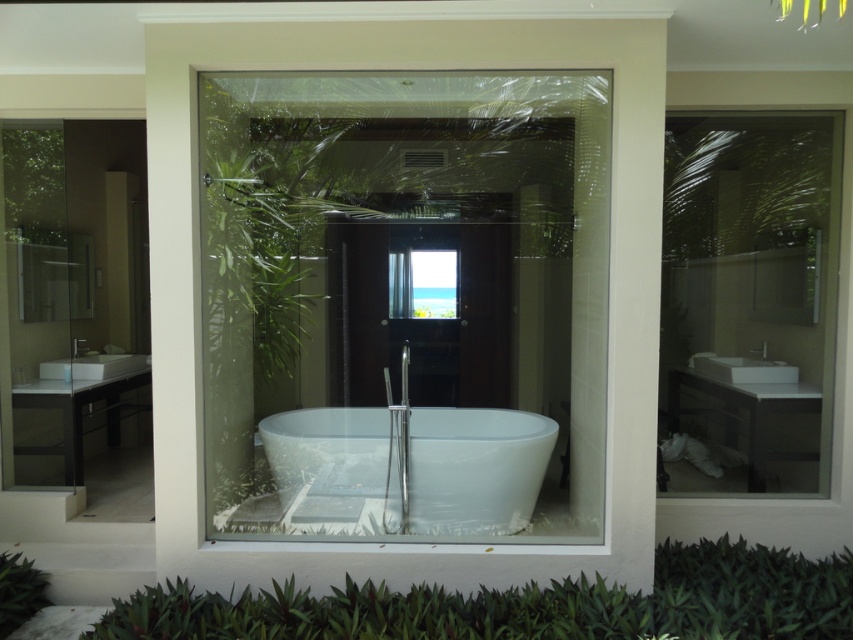
You are a guest in this bathroom and want to take a bath. You see both the transparent glass bathtub at center and the white glossy bathtub at center. Which one is on the right side from your perspective?

The transparent glass bathtub at center is positioned on the right side of the white glossy bathtub at center.

You are a delivery person who needs to place a new 6.5 feet long sofa in the bathroom. The sofa must be placed between the transparent glass bathtub at center and the white ceramic sink at center. Is there enough space between them to fit the sofa?

The distance between the transparent glass bathtub at center and the white ceramic sink at center is 6.84 feet. Since the sofa is 6.5 feet long, there is enough space to fit it between them as 6.84 feet is greater than 6.5 feet.